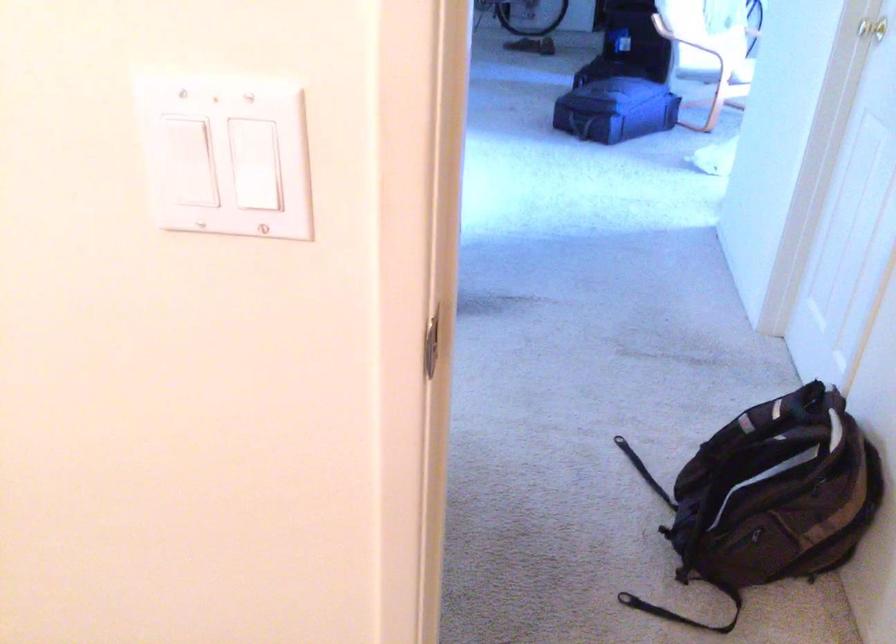
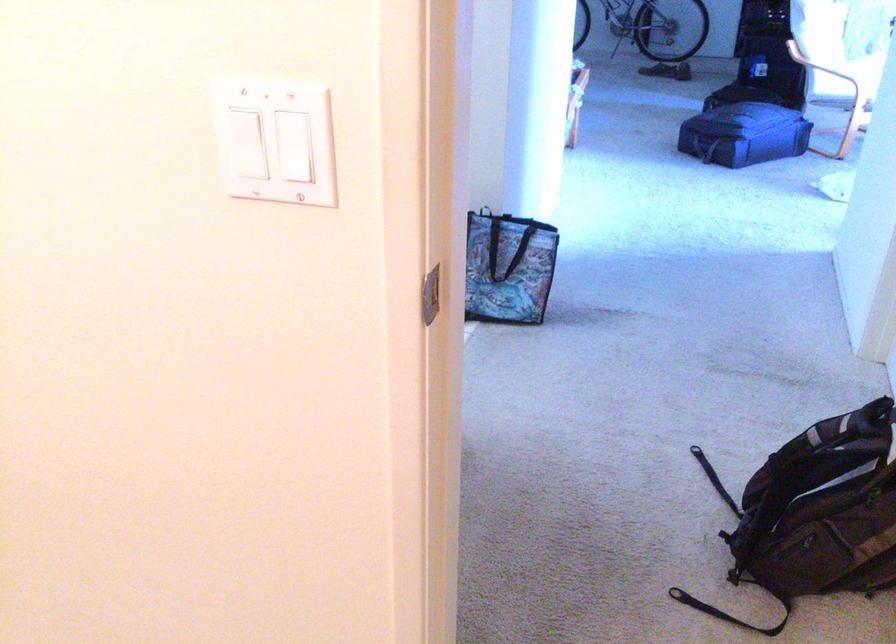
The point at (x=739, y=442) is marked in the first image. Where is the corresponding point in the second image?

(805, 446)